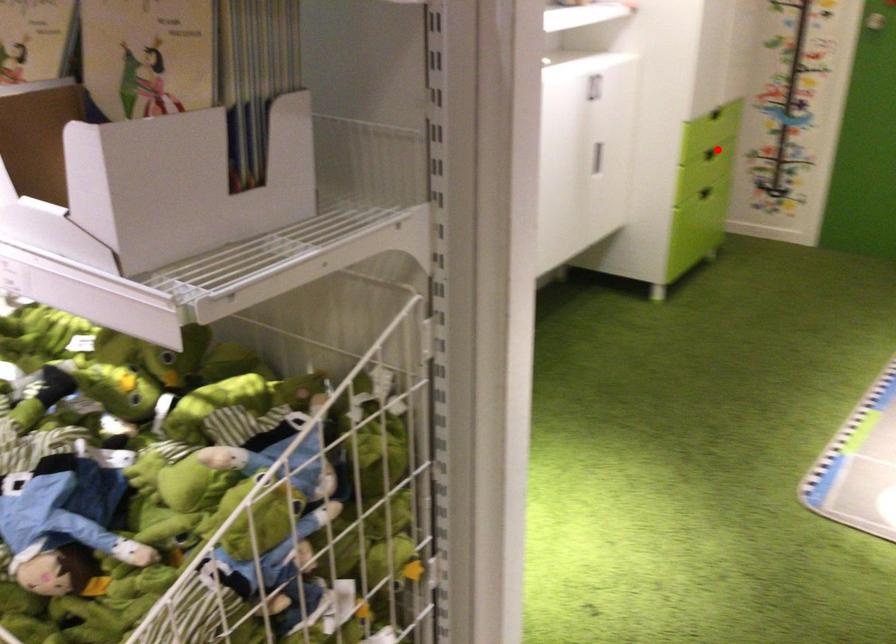
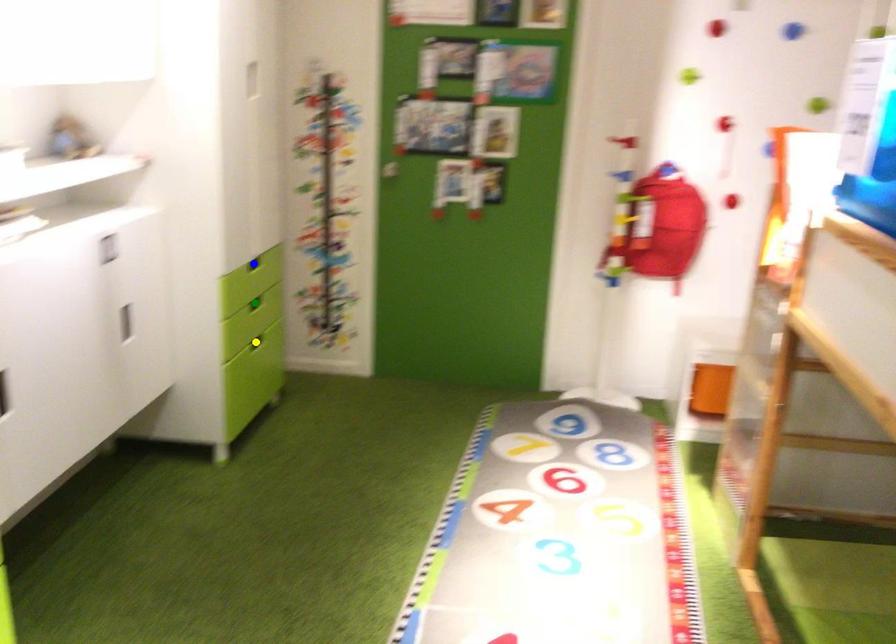
Question: I am providing you with two images of the same scene from different viewpoints. A red point is marked on the first image. You are given multiple points on the second image. In image 2, which mark is for the same physical point as the one in image 1?

Choices:
 (A) yellow point
 (B) green point
 (C) blue point

Answer: (B)